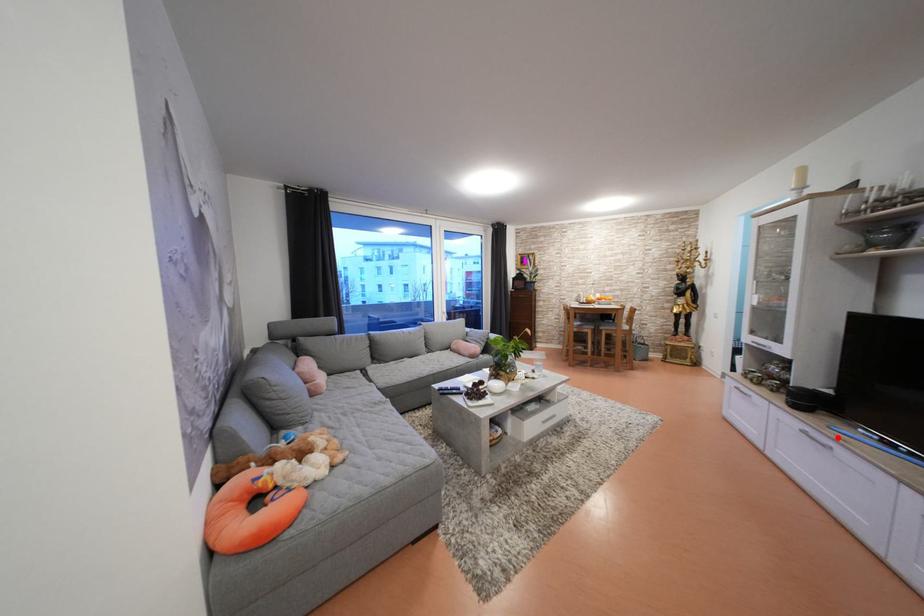
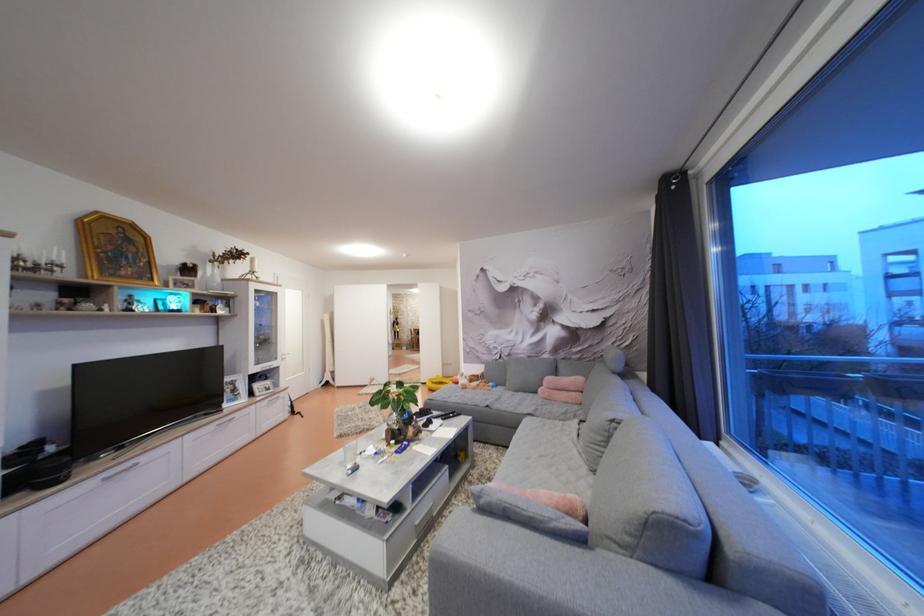
Locate, in the second image, the point that corresponds to the highlighted location in the first image.

(126, 466)